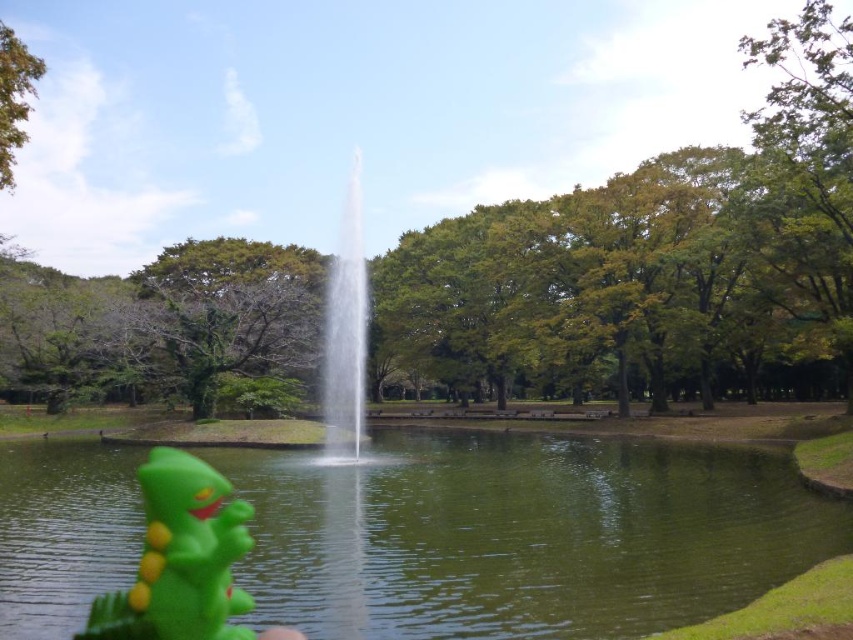
Can you confirm if green rubber water at center is bigger than green rubber toy at lower left?

Actually, green rubber water at center might be smaller than green rubber toy at lower left.

Where is `green rubber water at center`? green rubber water at center is located at coordinates (521, 536).

Is green rubber water at center taller than clear water fountain at center?

No, green rubber water at center is not taller than clear water fountain at center.

How distant is green rubber water at center from clear water fountain at center?

17.23 meters

At what (x,y) coordinates should I click in order to perform the action: click on green rubber water at center. Please return your answer as a coordinate pair (x, y). This screenshot has height=640, width=853. Looking at the image, I should click on (521, 536).

Between point (178, 634) and point (354, 420), which one is positioned behind?

Positioned behind is point (354, 420).

Can you confirm if green rubber toy at lower left is smaller than clear water fountain at center?

Yes.

Where is `green rubber toy at lower left`? green rubber toy at lower left is located at coordinates (183, 560).